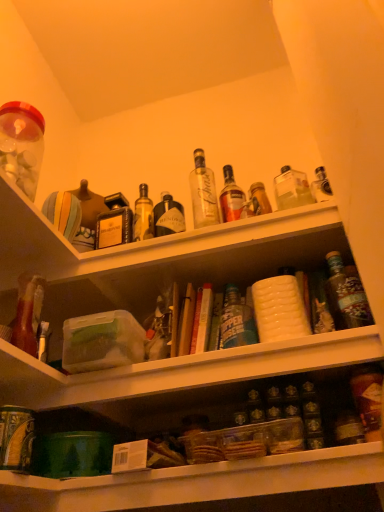
Question: Can you confirm if white textured container at center, positioned as the first shelf in top-to-bottom order, is taller than shiny dark brown bottle at right, the first bottle viewed from the top?

Choices:
 (A) no
 (B) yes

Answer: (A)

Question: Is white textured container at center, the second shelf positioned from the bottom, oriented towards shiny dark brown bottle at right, acting as the 2th bottle starting from the bottom?

Choices:
 (A) no
 (B) yes

Answer: (A)

Question: Is white textured container at center, positioned as the first shelf in top-to-bottom order, further to camera compared to shiny dark brown bottle at right, arranged as the second bottle when viewed from the front?

Choices:
 (A) yes
 (B) no

Answer: (A)

Question: From a real-world perspective, does white textured container at center, the second shelf positioned from the bottom, sit lower than shiny dark brown bottle at right, acting as the 2th bottle starting from the bottom?

Choices:
 (A) no
 (B) yes

Answer: (A)

Question: Considering the relative sizes of white textured container at center, positioned as the first shelf in top-to-bottom order, and shiny dark brown bottle at right, which ranks as the first bottle in back-to-front order, in the image provided, is white textured container at center, positioned as the first shelf in top-to-bottom order, wider than shiny dark brown bottle at right, which ranks as the first bottle in back-to-front order,?

Choices:
 (A) yes
 (B) no

Answer: (A)

Question: From the image's perspective, is white textured container at center, positioned as the first shelf in top-to-bottom order, under shiny dark brown bottle at right, arranged as the second bottle when viewed from the front?

Choices:
 (A) yes
 (B) no

Answer: (B)

Question: Is translucent plastic jar at upper left aimed at translucent glass bottle at lower right, positioned as the second bottle in top-to-bottom order?

Choices:
 (A) no
 (B) yes

Answer: (A)

Question: Is translucent plastic jar at upper left smaller than translucent glass bottle at lower right, which is the second bottle in back-to-front order?

Choices:
 (A) no
 (B) yes

Answer: (A)

Question: Does translucent plastic jar at upper left have a lesser width compared to translucent glass bottle at lower right, which is counted as the 1th bottle, starting from the bottom?

Choices:
 (A) yes
 (B) no

Answer: (B)

Question: Is translucent plastic jar at upper left not inside translucent glass bottle at lower right, marked as the 1th bottle in a front-to-back arrangement?

Choices:
 (A) no
 (B) yes

Answer: (B)

Question: Is translucent plastic jar at upper left to the right of translucent glass bottle at lower right, which is the second bottle in back-to-front order, from the viewer's perspective?

Choices:
 (A) yes
 (B) no

Answer: (B)

Question: From a real-world perspective, is translucent plastic jar at upper left located higher than translucent glass bottle at lower right, marked as the 1th bottle in a front-to-back arrangement?

Choices:
 (A) no
 (B) yes

Answer: (B)

Question: Does translucent glass bottle at lower right, which is counted as the 1th bottle, starting from the bottom, appear on the right side of translucent plastic jar at upper left?

Choices:
 (A) yes
 (B) no

Answer: (A)